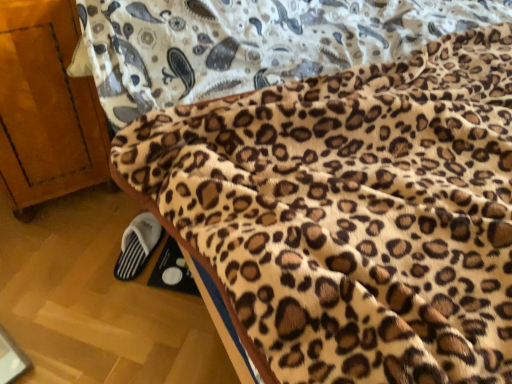
Where is `free location to the left of white fabric slipper at lower left`? Image resolution: width=512 pixels, height=384 pixels. free location to the left of white fabric slipper at lower left is located at coordinates (86, 243).